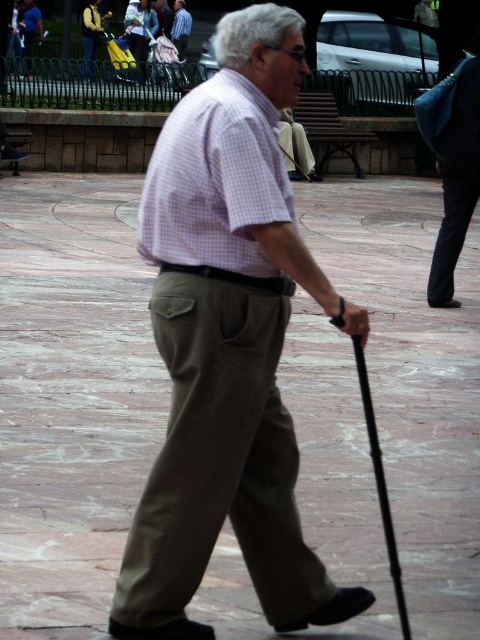
You are an observer standing in the park and see the elderly man with the brown stone pavement at center and the light blue shirt at center. Which object is closer to the ground?

The brown stone pavement at center is located below light blue shirt at center, so it is closer to the ground.

The elderly man in the scene is wearing a light brown cotton pants at center and a light blue shirt at center. Which item of clothing has a greater width?

The light brown cotton pants at center has a greater width than the light blue shirt at center.

You are a fashion designer analyzing the clothing of the elderly man in the image. Based on the scene, which clothing item has a larger size between the light brown cotton pants at center and the purple checkered shirt at center?

The light brown cotton pants at center has a larger size compared to the purple checkered shirt at center.